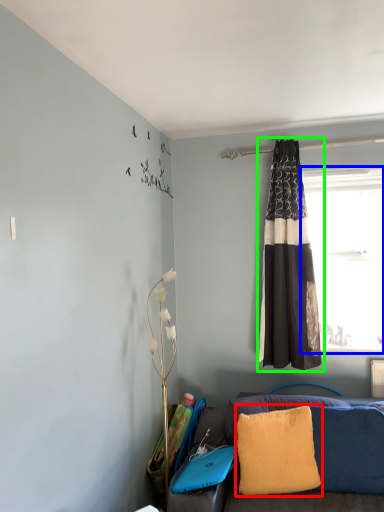
Question: Which object is the farthest from pillow (highlighted by a red box)? Choose among these: window (highlighted by a blue box) or curtain (highlighted by a green box).

Choices:
 (A) window
 (B) curtain

Answer: (A)